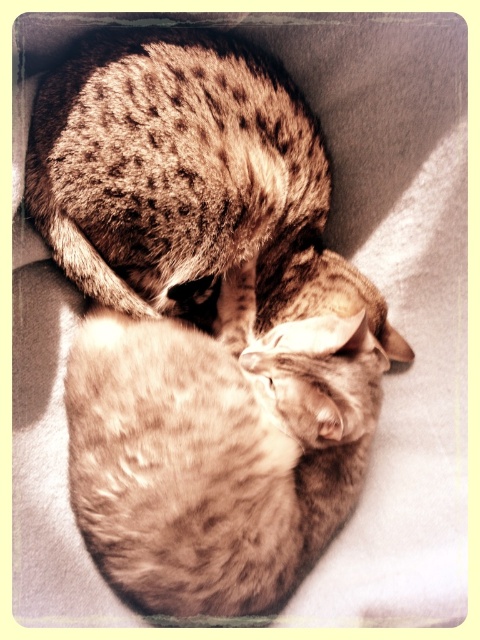
You are a photographer trying to capture a closeup of the spotted fur cat at center without the spotted fur cat at upper center blocking the view. Is this possible given their positions?

The spotted fur cat at center is in front of the spotted fur cat at upper center, so you can capture a closeup of the spotted fur cat at center without obstruction from the other cat.

You are standing in front of the image of two cats resting together. There are two points marked in the image. The first point is at coordinate point (113, 403) and the second is at point (253, 115). Which of these two points is nearer to you?

Point (113, 403) is closer to the viewer than point (253, 115).

You are observing two cats resting in a cozy environment. There is a spotted fur cat at center and another cat. Which cat is positioned closer to the center of the image?

The spotted fur cat at center is located at point (224, 442), which is closer to the center of the image compared to the other cat.